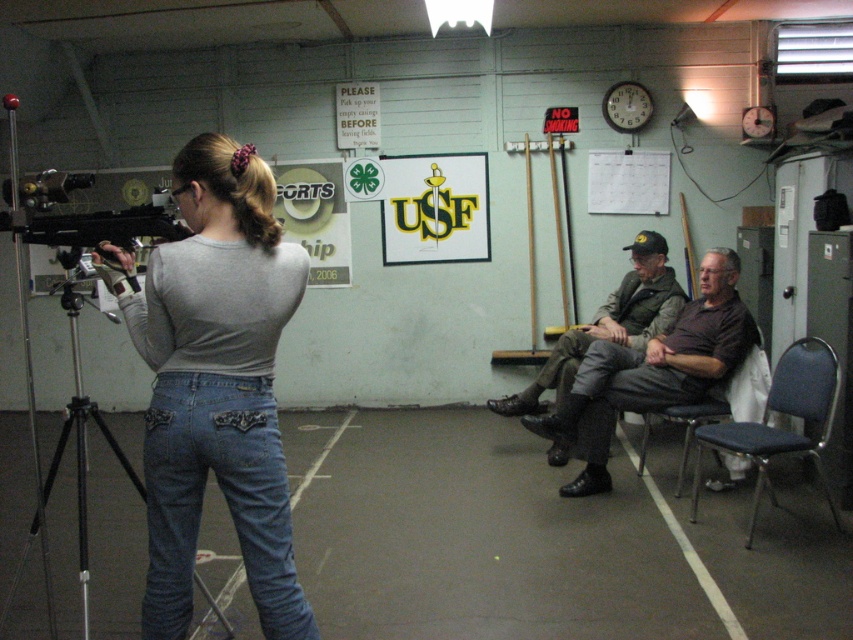
Question: Among these points, which one is farthest from the camera?

Choices:
 (A) (642, 448)
 (B) (566, 410)
 (C) (183, 577)
 (D) (187, 577)

Answer: (A)

Question: Which point is closer to the camera?

Choices:
 (A) dark brown leather jacket at center
 (B) blue padded chair at right
 (C) denim at left
 (D) denim at right

Answer: (C)

Question: Which object is the closest to the blue padded chair at right?

Choices:
 (A) denim jeans at center
 (B) dark brown leather jacket at center
 (C) denim at right

Answer: (B)

Question: Where is denim at left located in relation to black leather chair at lower right in the image?

Choices:
 (A) left
 (B) right

Answer: (A)

Question: Is the position of denim at left less distant than that of black leather chair at lower right?

Choices:
 (A) no
 (B) yes

Answer: (B)

Question: In this image, where is blue padded chair at right located relative to black leather chair at lower right?

Choices:
 (A) right
 (B) left

Answer: (A)